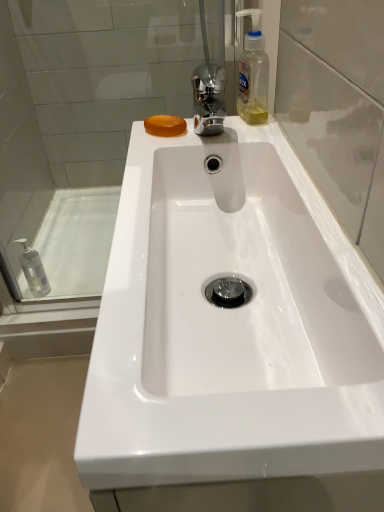
Locate an element on the screen. vacant area to the right of orange translucent soap at upper left is located at coordinates (244, 130).